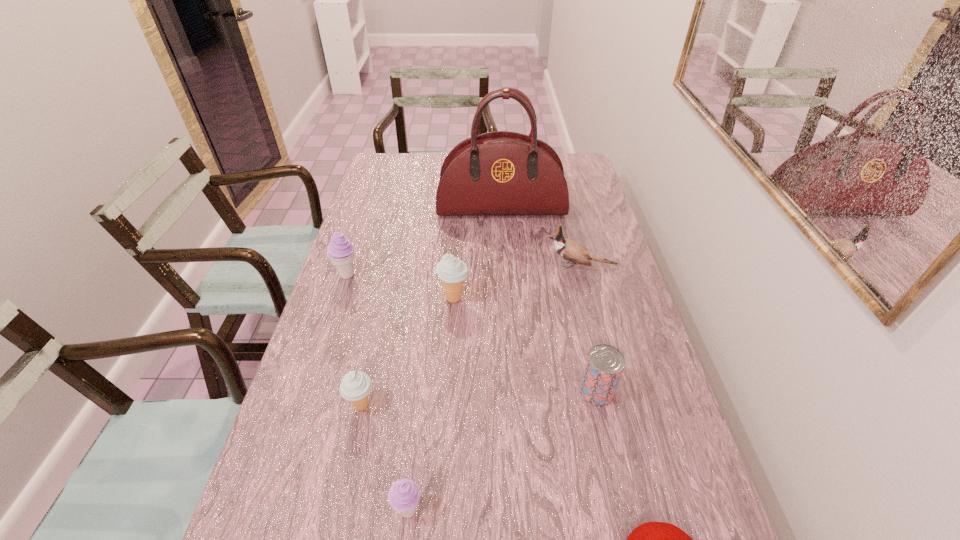
Locate an element on the screen. free space located on the left of the second icecream from left to right is located at coordinates (318, 406).

This screenshot has width=960, height=540. What are the coordinates of `handbag that is at the right edge` in the screenshot? It's located at (497, 173).

Where is `bird positioned at the right edge`? Image resolution: width=960 pixels, height=540 pixels. bird positioned at the right edge is located at coordinates (569, 250).

The height and width of the screenshot is (540, 960). What are the coordinates of `beer can at the right edge` in the screenshot? It's located at (604, 366).

This screenshot has width=960, height=540. In the image, there is a desktop. Identify the location of vacant area at the left edge. (326, 329).

The height and width of the screenshot is (540, 960). What are the coordinates of `free spot at the right edge of the desktop` in the screenshot? It's located at (639, 410).

Image resolution: width=960 pixels, height=540 pixels. I want to click on free space at the far left corner, so click(401, 168).

Locate an element on the screen. This screenshot has width=960, height=540. free space at the far right corner of the desktop is located at coordinates (575, 178).

Find the location of a particular element. Image resolution: width=960 pixels, height=540 pixels. empty space that is in between the seventh object from right to left and the beer can is located at coordinates (479, 399).

Where is `vacant space in between the right purple icecream and the red beer can`? This screenshot has width=960, height=540. vacant space in between the right purple icecream and the red beer can is located at coordinates (503, 451).